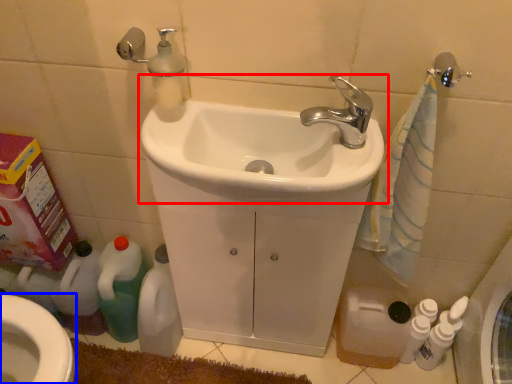
Question: Which object appears farthest to the camera in this image, sink (highlighted by a red box) or bidet (highlighted by a blue box)?

Choices:
 (A) sink
 (B) bidet

Answer: (B)